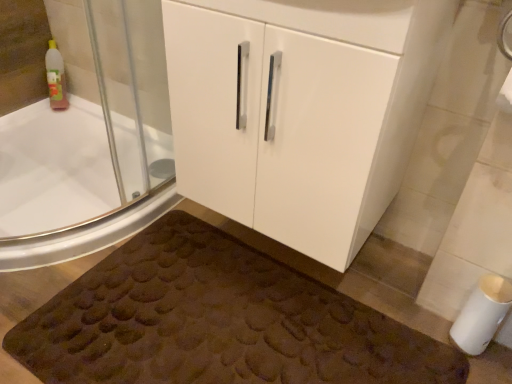
Find the location of a particular element. The image size is (512, 384). unoccupied area behind white matte toilet paper at lower right is located at coordinates (409, 284).